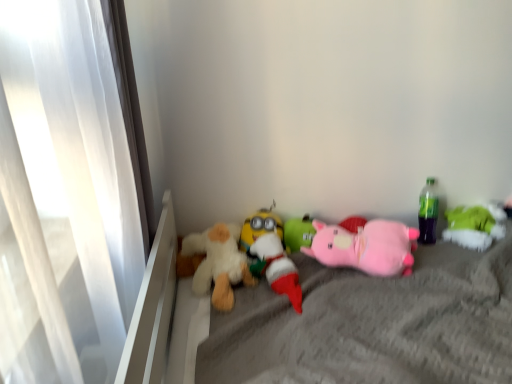
Question: Can you confirm if fluffy white teddy bear at center, acting as the 1th toy starting from the left, is positioned to the left of soft gray fabric mattress at center?

Choices:
 (A) no
 (B) yes

Answer: (B)

Question: Considering the relative sizes of fluffy white teddy bear at center, positioned as the 6th toy in right-to-left order, and soft gray fabric mattress at center in the image provided, is fluffy white teddy bear at center, positioned as the 6th toy in right-to-left order, taller than soft gray fabric mattress at center?

Choices:
 (A) no
 (B) yes

Answer: (A)

Question: Considering the relative sizes of fluffy white teddy bear at center, positioned as the 6th toy in right-to-left order, and soft gray fabric mattress at center in the image provided, is fluffy white teddy bear at center, positioned as the 6th toy in right-to-left order, shorter than soft gray fabric mattress at center?

Choices:
 (A) yes
 (B) no

Answer: (A)

Question: Does fluffy white teddy bear at center, positioned as the 6th toy in right-to-left order, have a greater width compared to soft gray fabric mattress at center?

Choices:
 (A) yes
 (B) no

Answer: (B)

Question: Does fluffy white teddy bear at center, positioned as the 6th toy in right-to-left order, have a smaller size compared to soft gray fabric mattress at center?

Choices:
 (A) yes
 (B) no

Answer: (A)

Question: In terms of size, does fluffy white teddy bear at center, positioned as the 6th toy in right-to-left order, appear bigger or smaller than soft gray fabric mattress at center?

Choices:
 (A) small
 (B) big

Answer: (A)

Question: Is fluffy white teddy bear at center, positioned as the 6th toy in right-to-left order, in front of or behind soft gray fabric mattress at center in the image?

Choices:
 (A) behind
 (B) front

Answer: (A)

Question: Is fluffy white teddy bear at center, positioned as the 6th toy in right-to-left order, wider or thinner than soft gray fabric mattress at center?

Choices:
 (A) wide
 (B) thin

Answer: (B)

Question: Considering the relative positions of fluffy white teddy bear at center, acting as the 1th toy starting from the left, and soft gray fabric mattress at center in the image provided, is fluffy white teddy bear at center, acting as the 1th toy starting from the left, to the left or to the right of soft gray fabric mattress at center?

Choices:
 (A) right
 (B) left

Answer: (B)

Question: From a real-world perspective, is white plush toy at center, the third toy when ordered from left to right, physically located above or below soft gray fabric mattress at center?

Choices:
 (A) below
 (B) above

Answer: (B)

Question: From the image's perspective, is white plush toy at center, the third toy when ordered from left to right, located above or below soft gray fabric mattress at center?

Choices:
 (A) above
 (B) below

Answer: (A)

Question: Considering the positions of white plush toy at center, which is counted as the fourth toy, starting from the right, and soft gray fabric mattress at center in the image, is white plush toy at center, which is counted as the fourth toy, starting from the right, bigger or smaller than soft gray fabric mattress at center?

Choices:
 (A) small
 (B) big

Answer: (A)

Question: Considering the positions of white plush toy at center, which is counted as the fourth toy, starting from the right, and soft gray fabric mattress at center in the image, is white plush toy at center, which is counted as the fourth toy, starting from the right, taller or shorter than soft gray fabric mattress at center?

Choices:
 (A) tall
 (B) short

Answer: (B)

Question: Considering the positions of point (287, 380) and point (339, 228), is point (287, 380) closer or farther from the camera than point (339, 228)?

Choices:
 (A) closer
 (B) farther

Answer: (A)

Question: Looking at their shapes, would you say soft gray fabric mattress at center is wider or thinner than pink plush pig at center, arranged as the 5th toy when viewed from the left?

Choices:
 (A) wide
 (B) thin

Answer: (A)